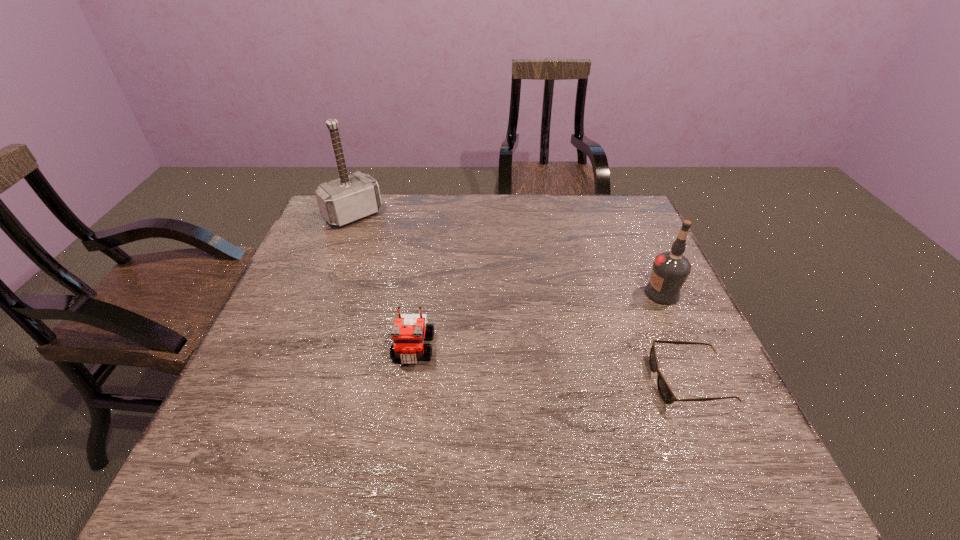
Find the location of a particular element. The image size is (960, 540). the second object from left to right is located at coordinates (410, 330).

Where is `the third tallest object`? the third tallest object is located at coordinates (410, 330).

I want to click on the shortest object, so click(665, 392).

What are the coordinates of `hammer` in the screenshot? It's located at (349, 198).

You are a GUI agent. You are given a task and a screenshot of the screen. Output one action in this format:
    pyautogui.click(x=<x>, y=<y>)
    Task: Click on the tallest object
    
    Given the screenshot: What is the action you would take?
    pyautogui.click(x=349, y=198)

This screenshot has height=540, width=960. What are the coordinates of `the second farthest object` in the screenshot? It's located at (670, 270).

Identify the location of the second tallest object. (670, 270).

You are a GUI agent. You are given a task and a screenshot of the screen. Output one action in this format:
    pyautogui.click(x=<x>, y=<y>)
    Task: Click on the vacant area located 0.050m on the front-facing side of the third object from right to left
    The image size is (960, 540).
    Given the screenshot: What is the action you would take?
    pyautogui.click(x=407, y=388)

Find the location of a particular element. blank space located 0.120m on the lenses of the sunglasses is located at coordinates [x=597, y=381].

Locate an element on the screen. The height and width of the screenshot is (540, 960). vacant region located on the lenses of the sunglasses is located at coordinates (490, 381).